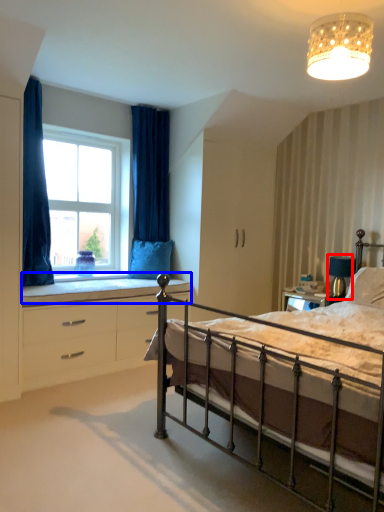
Question: Which point is further to the camera, table lamp (highlighted by a red box) or window sill (highlighted by a blue box)?

Choices:
 (A) table lamp
 (B) window sill

Answer: (A)